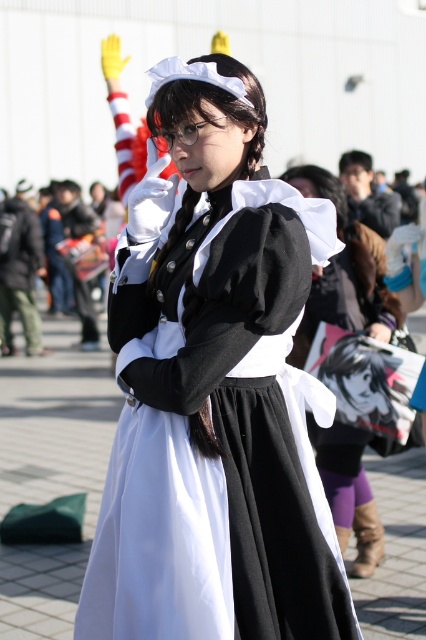
Question: Among these points, which one is farthest from the camera?

Choices:
 (A) (357, 259)
 (B) (264, 237)

Answer: (A)

Question: Does matte black dress at center have a smaller size compared to white satin dress at center?

Choices:
 (A) yes
 (B) no

Answer: (B)

Question: Does matte black dress at center lie in front of white satin dress at center?

Choices:
 (A) no
 (B) yes

Answer: (B)

Question: Which point appears farthest from the camera in this image?

Choices:
 (A) (135, 556)
 (B) (367, 296)

Answer: (B)

Question: Which of the following is the farthest from the observer?

Choices:
 (A) white satin dress at center
 (B) matte black dress at center

Answer: (A)

Question: Is matte black dress at center smaller than white satin dress at center?

Choices:
 (A) yes
 (B) no

Answer: (B)